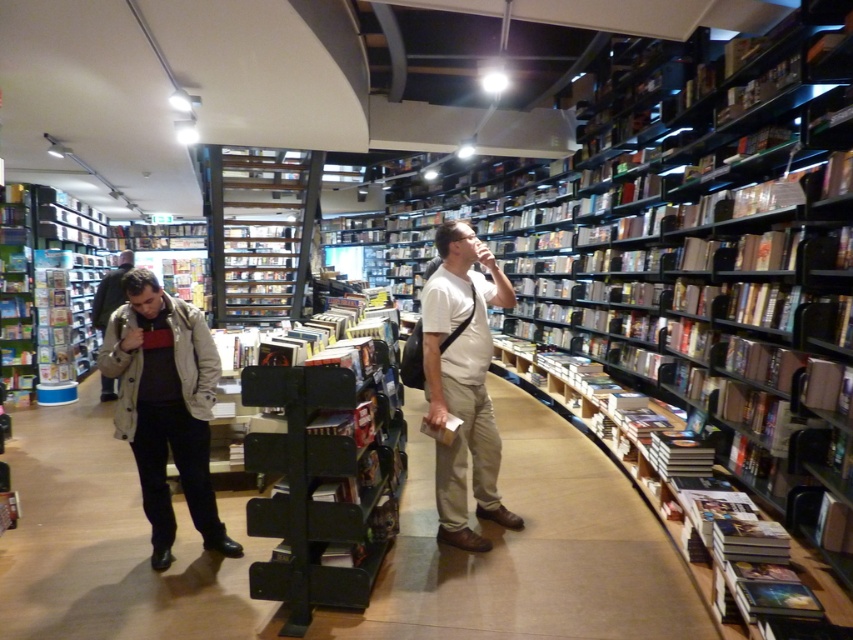
In the scene shown: Between white matte shirt at center and light beige cotton jacket at center, which one has less height?

With less height is light beige cotton jacket at center.

Based on the photo, can you confirm if white matte shirt at center is thinner than light beige cotton jacket at center?

Correct, white matte shirt at center's width is less than light beige cotton jacket at center's.

This screenshot has height=640, width=853. What are the coordinates of `white matte shirt at center` in the screenshot? It's located at click(x=462, y=381).

Who is more distant from viewer, (496, 278) or (100, 317)?

The point (100, 317) is more distant.

Who is more distant from viewer, (468, 234) or (108, 285)?

The point (108, 285) is behind.

This screenshot has width=853, height=640. I want to click on light beige cotton jacket at center, so click(x=461, y=365).

Is white matte shirt at center above metallic silver shelves at center?

No.

From the picture: Does white matte shirt at center have a larger size compared to metallic silver shelves at center?

Incorrect, white matte shirt at center is not larger than metallic silver shelves at center.

Is point (461, 317) positioned after point (213, 292)?

No.

Locate an element on the screen. The image size is (853, 640). white matte shirt at center is located at coordinates (462, 381).